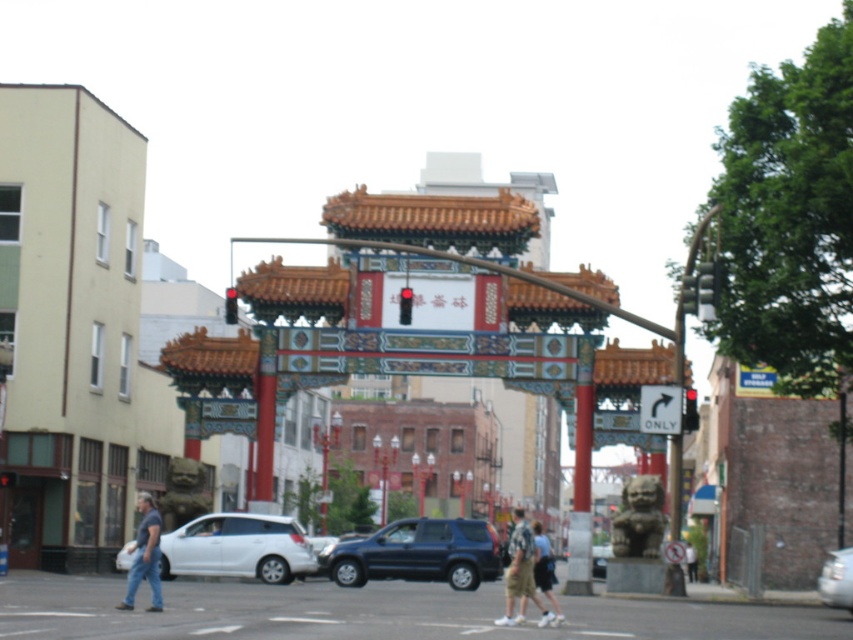
Does matte black suv at center have a smaller size compared to light brown shorts at center?

Correct, matte black suv at center occupies less space than light brown shorts at center.

Is matte black suv at center below light brown shorts at center?

Indeed, matte black suv at center is positioned under light brown shorts at center.

The width and height of the screenshot is (853, 640). What do you see at coordinates (416, 554) in the screenshot?
I see `matte black suv at center` at bounding box center [416, 554].

Locate an element on the screen. matte black suv at center is located at coordinates (416, 554).

Measure the distance between camouflage shirt at center and camera.

A distance of 253.64 feet exists between camouflage shirt at center and camera.

Image resolution: width=853 pixels, height=640 pixels. Describe the element at coordinates (521, 572) in the screenshot. I see `camouflage shirt at center` at that location.

I want to click on camouflage shirt at center, so click(x=521, y=572).

Locate an element on the screen. camouflage shirt at center is located at coordinates (521, 572).

Can you confirm if black plastic arrow at center is positioned above light brown shorts at center?

Correct, black plastic arrow at center is located above light brown shorts at center.

In the scene shown: Who is more distant from viewer, (642, 422) or (543, 593)?

The point (642, 422) is behind.

Identify the location of black plastic arrow at center. The height and width of the screenshot is (640, 853). (660, 408).